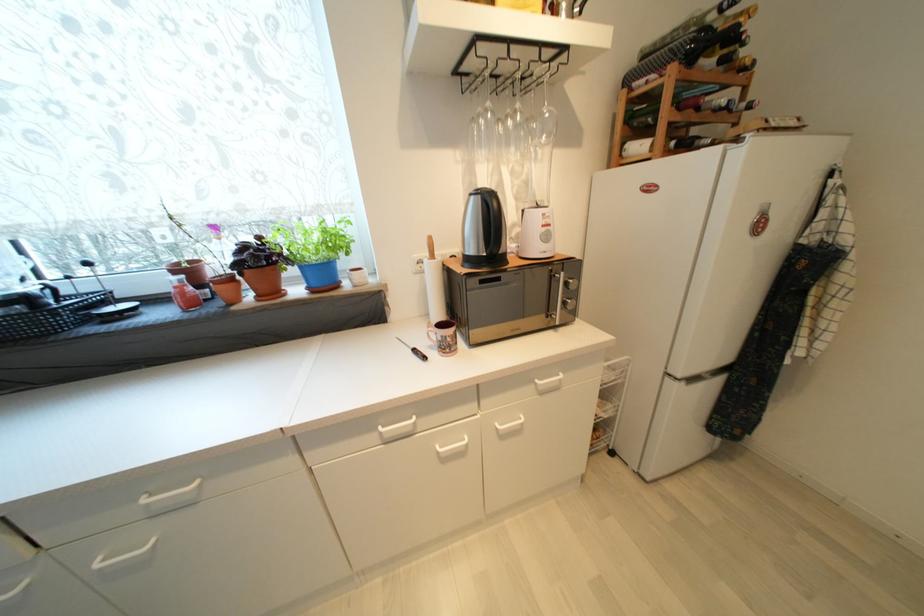
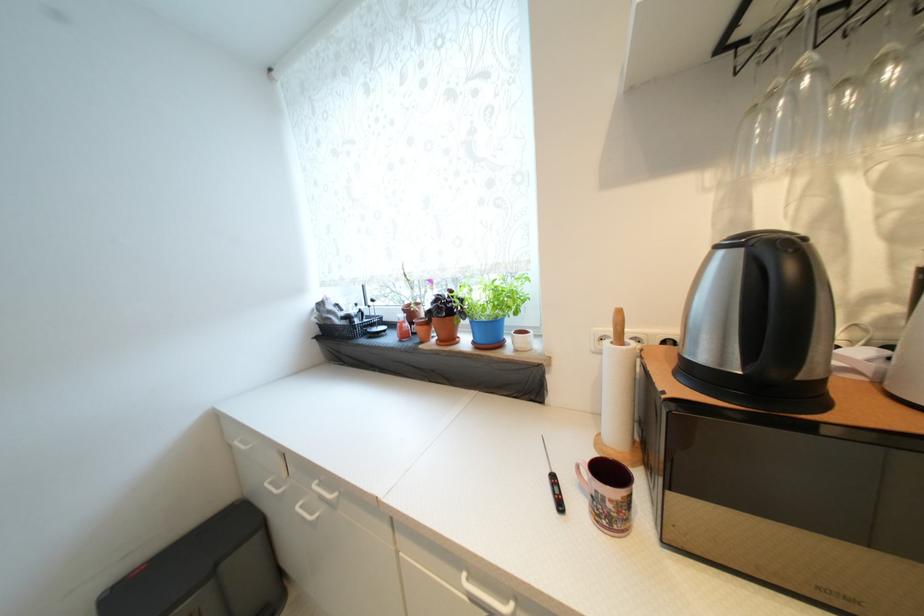
The point at [454,341] is marked in the first image. Where is the corresponding point in the second image?

(614, 508)